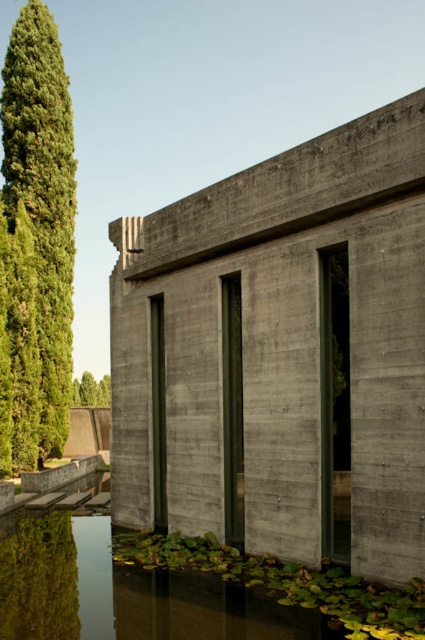
In the scene shown: Is gray concrete wall at center above green mossy water at lower center?

Yes, gray concrete wall at center is above green mossy water at lower center.

Between point (314, 506) and point (206, 596), which one is positioned in front?

Positioned in front is point (206, 596).

This screenshot has width=425, height=640. What do you see at coordinates (280, 353) in the screenshot?
I see `gray concrete wall at center` at bounding box center [280, 353].

Identify the location of gray concrete wall at center. (280, 353).

Which is behind, point (299, 150) or point (33, 184)?

The point (33, 184) is behind.

Image resolution: width=425 pixels, height=640 pixels. I want to click on gray concrete wall at center, so click(x=280, y=353).

Where is `gray concrete wall at center`? This screenshot has width=425, height=640. gray concrete wall at center is located at coordinates (280, 353).

Can you confirm if gray concrete wall at center is shorter than green leafy tree at upper left?

Incorrect, gray concrete wall at center's height does not fall short of green leafy tree at upper left's.

Who is shorter, gray concrete wall at center or green leafy tree at upper left?

green leafy tree at upper left is shorter.

You are a GUI agent. You are given a task and a screenshot of the screen. Output one action in this format:
    pyautogui.click(x=<x>, y=<y>)
    Task: Click on the gray concrete wall at center
    The height and width of the screenshot is (640, 425).
    Given the screenshot: What is the action you would take?
    pyautogui.click(x=280, y=353)

You are a GUI agent. You are given a task and a screenshot of the screen. Output one action in this format:
    pyautogui.click(x=<x>, y=<y>)
    Task: Click on the gray concrete wall at center
    
    Given the screenshot: What is the action you would take?
    pyautogui.click(x=280, y=353)